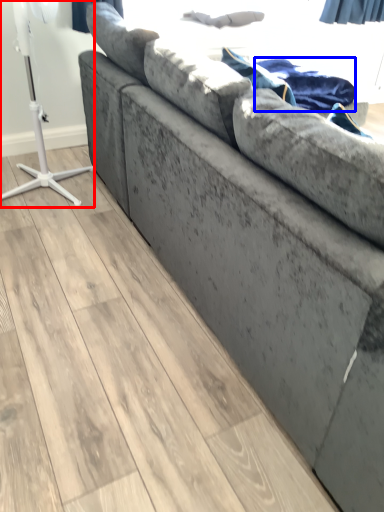
Question: Among these objects, which one is nearest to the camera, table lamp (highlighted by a red box) or blanket (highlighted by a blue box)?

Choices:
 (A) table lamp
 (B) blanket

Answer: (A)